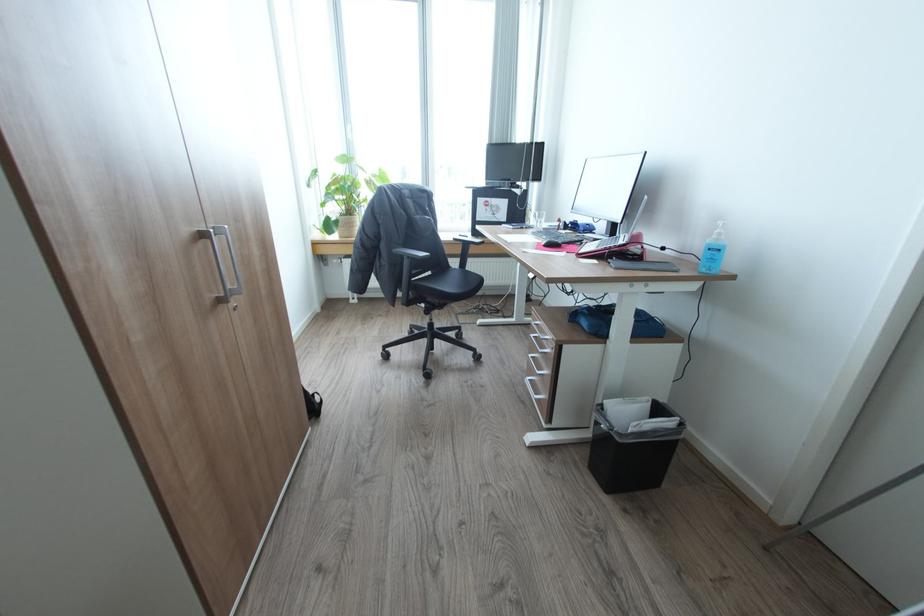
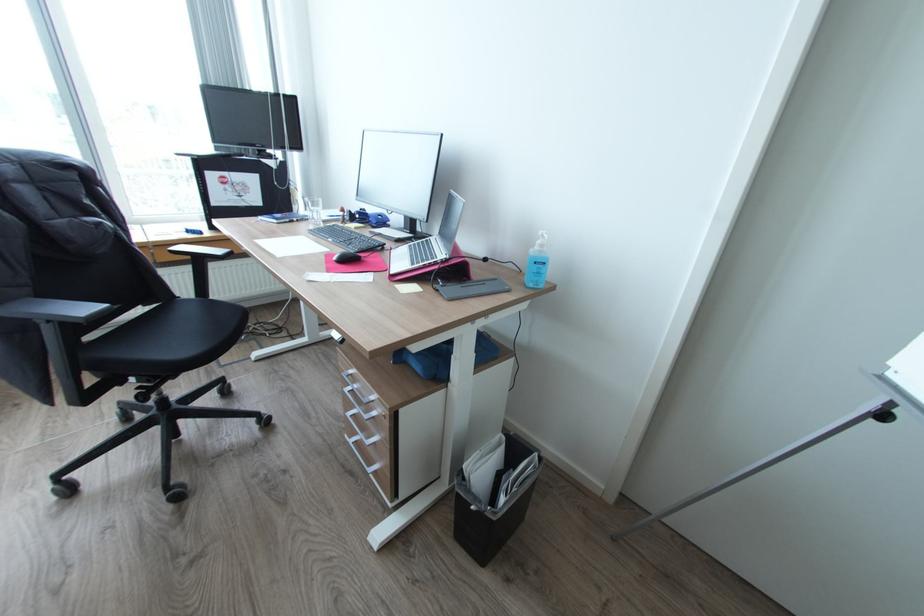
Where in the second image is the point corresponding to [543,225] from the first image?

(321, 217)